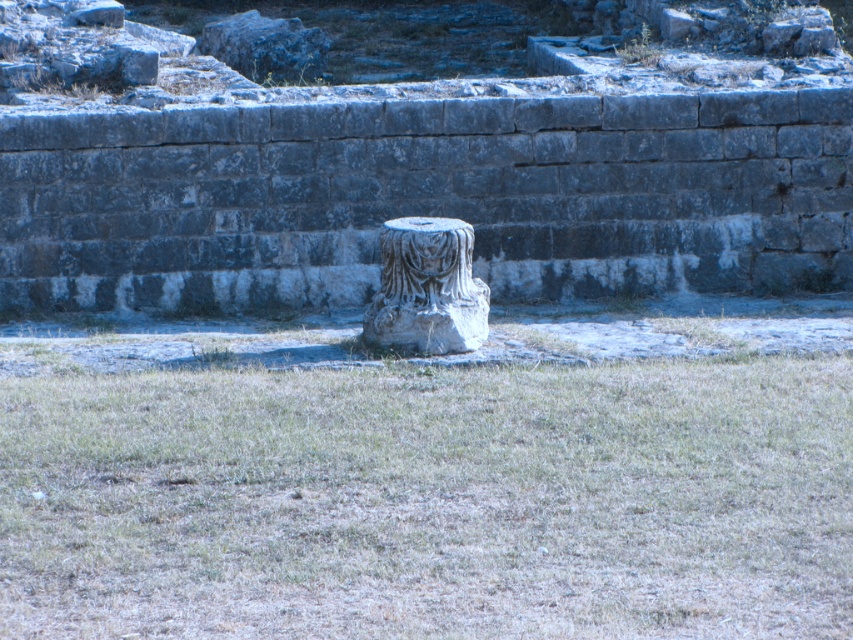
Question: Is green grass at center thinner than carved stone pedestal at center?

Choices:
 (A) no
 (B) yes

Answer: (A)

Question: In this image, where is green grass at center located relative to carved stone pedestal at center?

Choices:
 (A) below
 (B) above

Answer: (A)

Question: Which point is closer to the camera?

Choices:
 (A) (480, 412)
 (B) (386, 292)

Answer: (A)

Question: Which point is closer to the camera?

Choices:
 (A) (419, 326)
 (B) (230, 524)

Answer: (B)

Question: Which point is closer to the camera taking this photo?

Choices:
 (A) (819, 323)
 (B) (466, 308)

Answer: (B)

Question: Is green grass at center to the right of carved stone pedestal at center from the viewer's perspective?

Choices:
 (A) yes
 (B) no

Answer: (B)